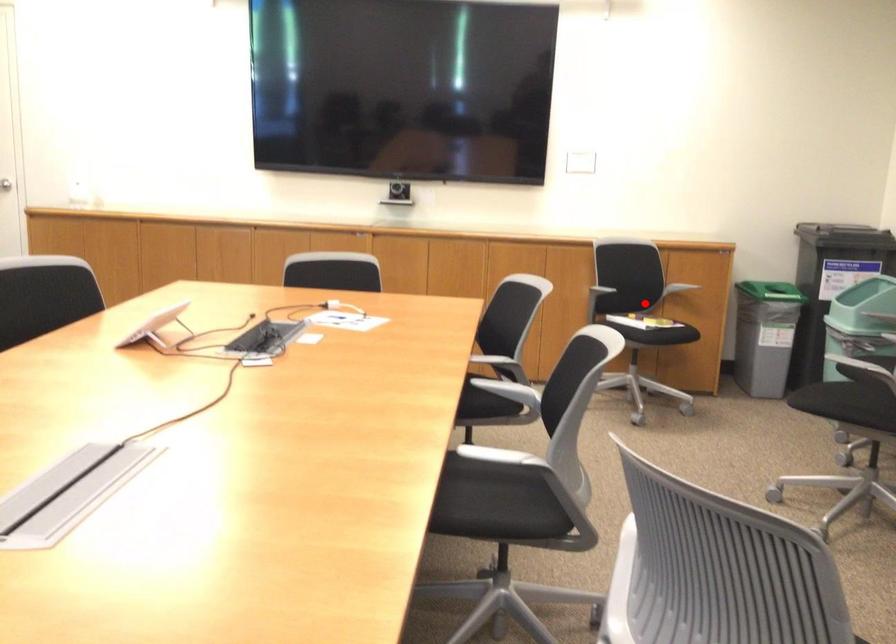
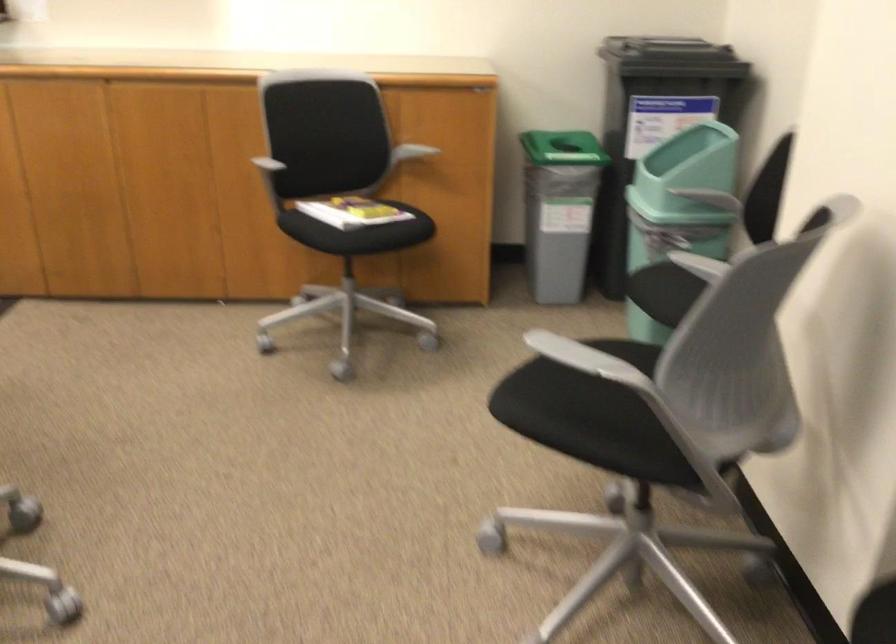
Question: A red point is marked in image1. In image2, is the corresponding 3D point closer to the camera or farther? Reply with the corresponding letter.

Choices:
 (A) The corresponding 3D point is closer.
 (B) The corresponding 3D point is farther.

Answer: (A)